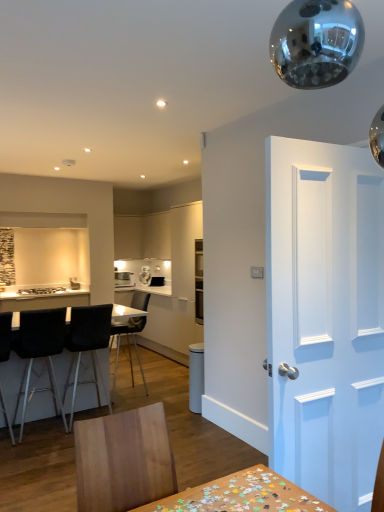
Question: Which direction should I rotate to look at satin silver toaster at center, the second appliance in the right-to-left sequence?

Choices:
 (A) right
 (B) left

Answer: (B)

Question: Is black leather chair at left, the 3th chair viewed from the front, next to matte white cabinet at center, which is counted as the 1th cabinetry, starting from the left, and touching it?

Choices:
 (A) no
 (B) yes

Answer: (A)

Question: Is black leather chair at left, acting as the second chair starting from the back, positioned with its back to matte white cabinet at center, which is counted as the 1th cabinetry, starting from the left?

Choices:
 (A) yes
 (B) no

Answer: (B)

Question: Is matte white cabinet at center, which is counted as the 1th cabinetry, starting from the left, a part of black leather chair at left, the 3th chair viewed from the front?

Choices:
 (A) yes
 (B) no

Answer: (B)

Question: From the image's perspective, is black leather chair at left, acting as the second chair starting from the back, over matte white cabinet at center, the 2th cabinetry positioned from the right?

Choices:
 (A) no
 (B) yes

Answer: (A)

Question: Is black leather chair at left, acting as the second chair starting from the back, far away from matte white cabinet at center, the 2th cabinetry positioned from the right?

Choices:
 (A) no
 (B) yes

Answer: (B)

Question: From a real-world perspective, is black leather chair at left, acting as the second chair starting from the back, physically above matte white cabinet at center, which is counted as the 1th cabinetry, starting from the left?

Choices:
 (A) no
 (B) yes

Answer: (A)

Question: Considering the relative positions of black leather chair at left, positioned as the 1th chair in front-to-back order, and white matte cabinet at center, marked as the second cabinetry in a left-to-right arrangement, in the image provided, is black leather chair at left, positioned as the 1th chair in front-to-back order, to the right of white matte cabinet at center, marked as the second cabinetry in a left-to-right arrangement, from the viewer's perspective?

Choices:
 (A) no
 (B) yes

Answer: (A)

Question: Considering the relative sizes of black leather chair at left, positioned as the 1th chair in front-to-back order, and white matte cabinet at center, marked as the second cabinetry in a left-to-right arrangement, in the image provided, is black leather chair at left, positioned as the 1th chair in front-to-back order, shorter than white matte cabinet at center, marked as the second cabinetry in a left-to-right arrangement,?

Choices:
 (A) no
 (B) yes

Answer: (A)

Question: From the image's perspective, would you say black leather chair at left, positioned as the 1th chair in front-to-back order, is positioned over white matte cabinet at center, which is counted as the first cabinetry, starting from the right?

Choices:
 (A) no
 (B) yes

Answer: (A)

Question: Is the surface of black leather chair at left, positioned as the 1th chair in front-to-back order, in direct contact with white matte cabinet at center, marked as the second cabinetry in a left-to-right arrangement?

Choices:
 (A) yes
 (B) no

Answer: (B)

Question: Is black leather chair at left, positioned as the 1th chair in front-to-back order, behind white matte cabinet at center, which is counted as the first cabinetry, starting from the right?

Choices:
 (A) no
 (B) yes

Answer: (A)

Question: Is black leather chair at left, positioned as the 1th chair in front-to-back order, positioned in front of white matte cabinet at center, which is counted as the first cabinetry, starting from the right?

Choices:
 (A) yes
 (B) no

Answer: (A)

Question: Can you confirm if matte white cabinet at center, which is counted as the 1th cabinetry, starting from the left, is positioned to the left of black matte chair at center, positioned as the fourth chair in front-to-back order?

Choices:
 (A) no
 (B) yes

Answer: (B)